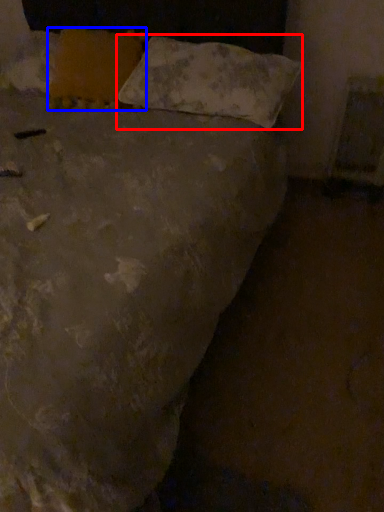
Question: Which point is further to the camera, pillow (highlighted by a red box) or pillow (highlighted by a blue box)?

Choices:
 (A) pillow
 (B) pillow

Answer: (B)